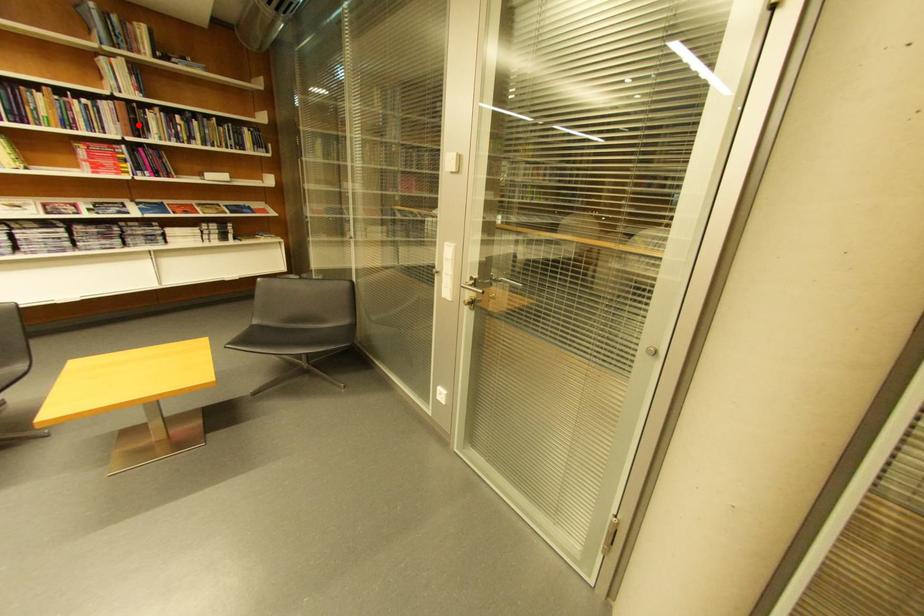
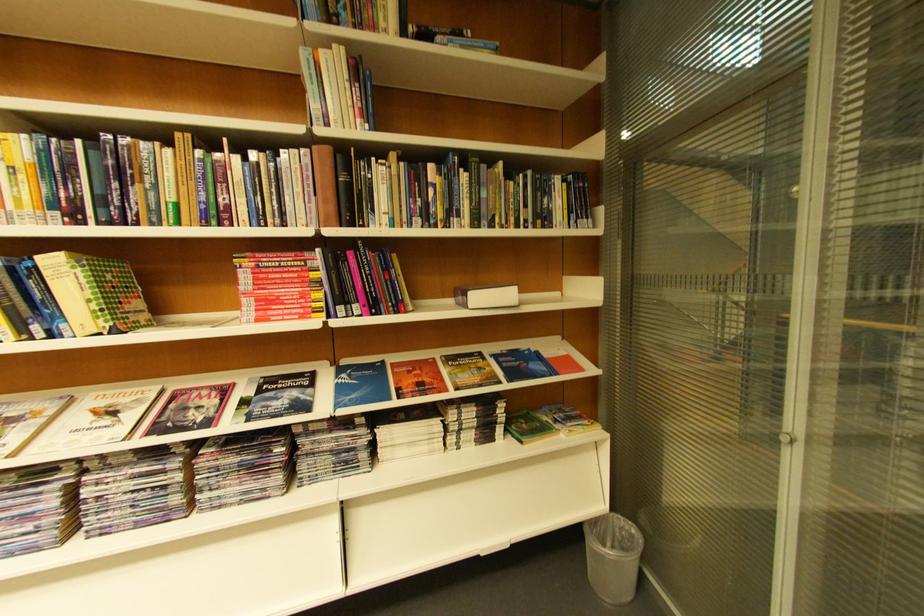
Where in the second image is the point corresponding to the highlighted location from the first image?

(342, 196)